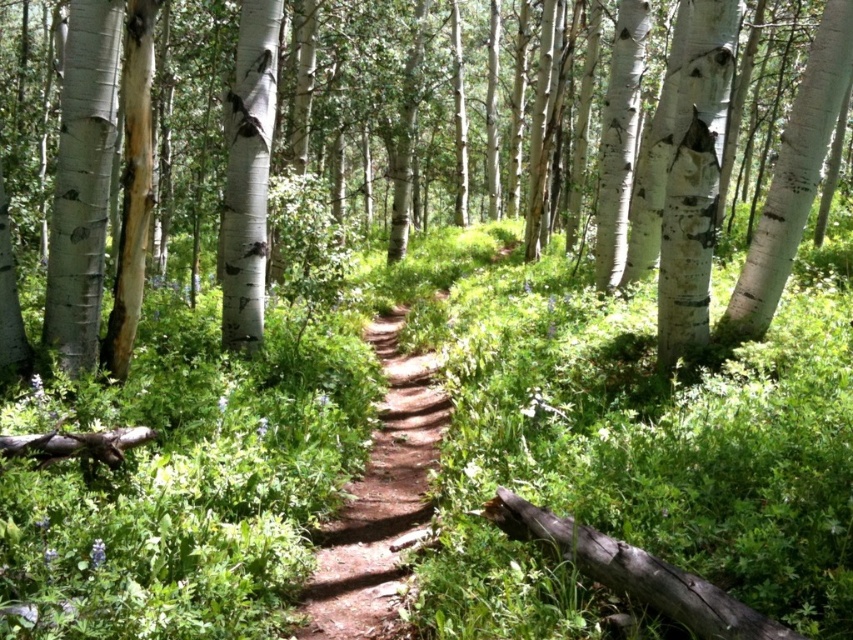
Between point (338, 77) and point (231, 232), which one is positioned behind?

Positioned behind is point (338, 77).

Which is below, white smooth tree at center or white smooth tree trunk at center?

white smooth tree trunk at center is below.

Find the location of a particular element. white smooth tree at center is located at coordinates (384, 106).

Who is higher up, brown dirt path at center or white smooth tree trunk at center?

white smooth tree trunk at center is higher up.

Between point (431, 419) and point (225, 189), which one is positioned behind?

The point (431, 419) is more distant.

Between point (312, 634) and point (247, 106), which one is positioned in front?

Point (312, 634) is more forward.

The width and height of the screenshot is (853, 640). Identify the location of brown dirt path at center. (378, 499).

Looking at this image, can you confirm if white smooth tree at center is shorter than brown dirt path at center?

In fact, white smooth tree at center may be taller than brown dirt path at center.

Which is more to the right, white smooth tree at center or brown dirt path at center?

brown dirt path at center is more to the right.

In order to click on white smooth tree at center in this screenshot , I will do `click(384, 106)`.